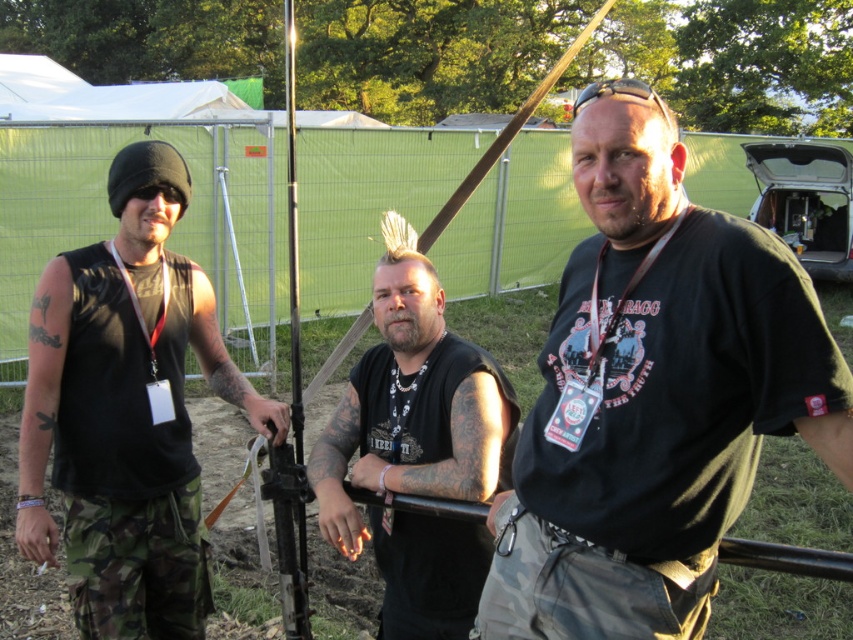
From the picture: Which of these two, black matte t-shirt at center or camouflage pants at lower left, stands shorter?

Standing shorter between the two is camouflage pants at lower left.

Which is behind, point (657, 148) or point (169, 561)?

The point (169, 561) is behind.

Identify the location of black matte t-shirt at center. The width and height of the screenshot is (853, 640). (654, 396).

Is black matte t-shirt at center to the left of black matte vest at center from the viewer's perspective?

Incorrect, black matte t-shirt at center is not on the left side of black matte vest at center.

Does black matte t-shirt at center appear under black matte vest at center?

Yes.

Does point (672, 211) come in front of point (456, 388)?

Yes.

Find the location of a particular element. This screenshot has width=853, height=640. black matte t-shirt at center is located at coordinates (654, 396).

Which is more to the right, black matte vest at center or camouflage pants at lower left?

black matte vest at center

Is black matte vest at center wider than camouflage pants at lower left?

Correct, the width of black matte vest at center exceeds that of camouflage pants at lower left.

What do you see at coordinates (412, 403) in the screenshot? I see `black matte vest at center` at bounding box center [412, 403].

Locate an element on the screen. black matte vest at center is located at coordinates (412, 403).